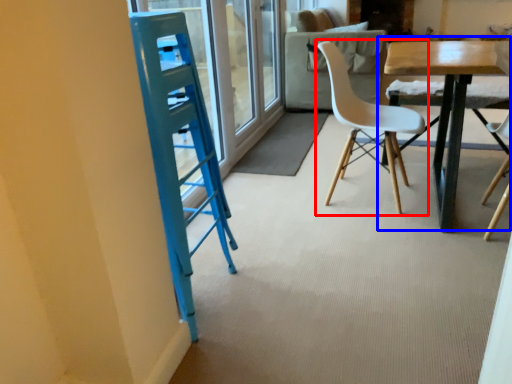
Question: Which object appears closest to the camera in this image, chair (highlighted by a red box) or table (highlighted by a blue box)?

Choices:
 (A) chair
 (B) table

Answer: (B)